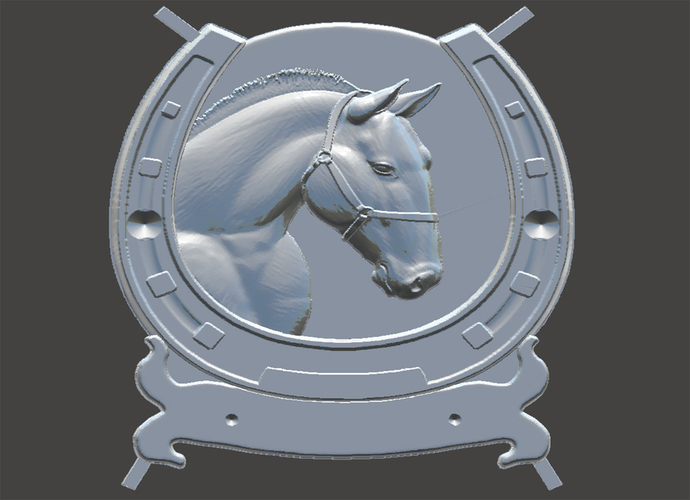
The image size is (690, 500). What are the coordinates of `1 silver plate` in the screenshot? It's located at (475, 241).